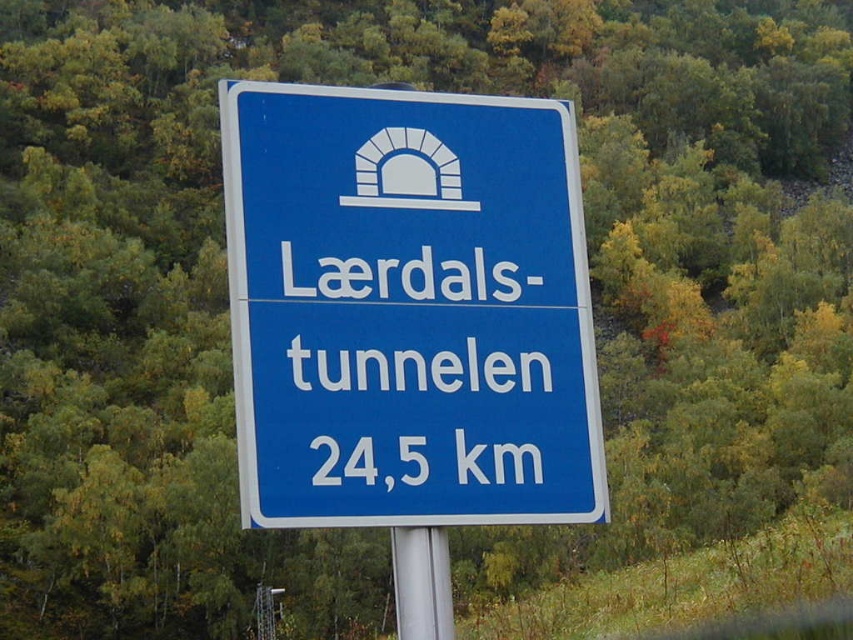
You are standing in front of the road sign and want to touch both the blue plastic sign at center and the silver metallic pole at center. Which object will your hand reach first?

The blue plastic sign at center is closer to the viewer than the silver metallic pole at center, so you will reach the blue plastic sign at center first.

You are a delivery driver who needs to attach a GPS tracker to the blue plastic sign at center. The tracker must be placed exactly 2 meters away from the silver metallic pole at center. Can you attach it directly to the sign without moving it further away?

The blue plastic sign at center is 2.48 meters away from the silver metallic pole at center. Since the required distance is 2 meters, the GPS tracker can be attached directly to the sign as it is already within the needed proximity.

You are standing in front of a road sign in a forest. The sign has a blue background and white text. There is a point marked at coordinates (408,308). What does this point indicate?

The point indicates the blue plastic sign at center.